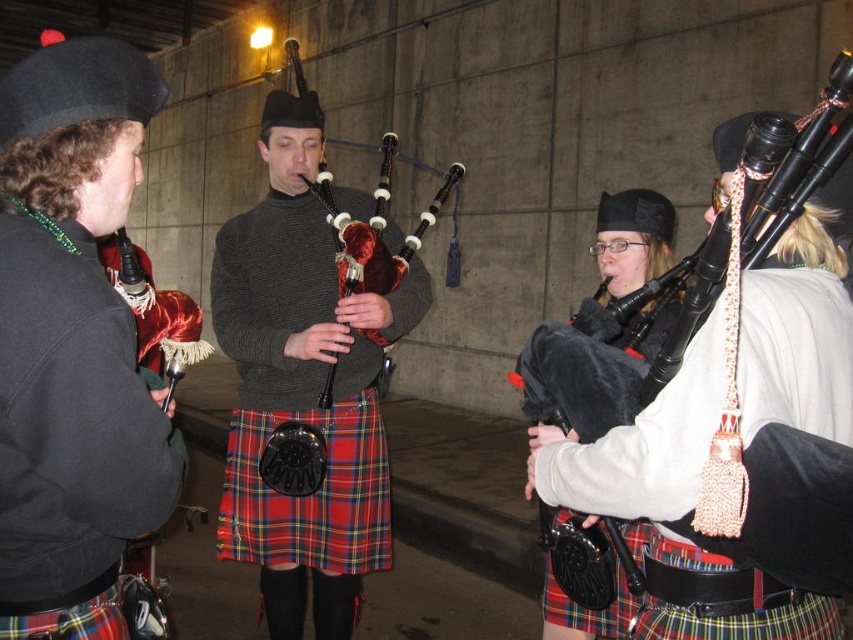
Question: Is matte black beret at left wider than black velvet bagpipes at center?

Choices:
 (A) no
 (B) yes

Answer: (A)

Question: Estimate the real-world distances between objects in this image. Which object is farther from the matte black bagpipe at center?

Choices:
 (A) velvet bagpipe at center
 (B) matte black beret at left
 (C) red plaid kilt at lower left
 (D) black velvet bagpipes at center

Answer: (C)

Question: Estimate the real-world distances between objects in this image. Which object is closer to the matte black bagpipe at center?

Choices:
 (A) velvet red bagpipes at center
 (B) red plaid kilt at lower left
 (C) matte black beret at left

Answer: (A)

Question: Considering the relative positions of black velvet bagpipes at center and red plaid kilt at lower left in the image provided, where is black velvet bagpipes at center located with respect to red plaid kilt at lower left?

Choices:
 (A) above
 (B) below

Answer: (A)

Question: Which object is farther from the camera taking this photo?

Choices:
 (A) velvet bagpipe at center
 (B) black velvet bagpipes at center
 (C) velvet red bagpipes at center

Answer: (C)

Question: Is velvet red bagpipes at center above velvet bagpipe at center?

Choices:
 (A) no
 (B) yes

Answer: (A)